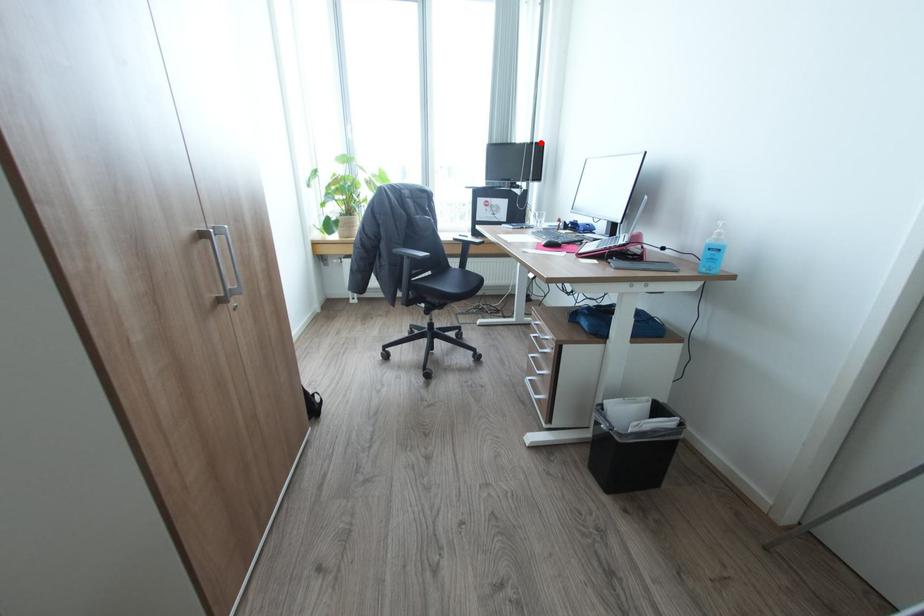
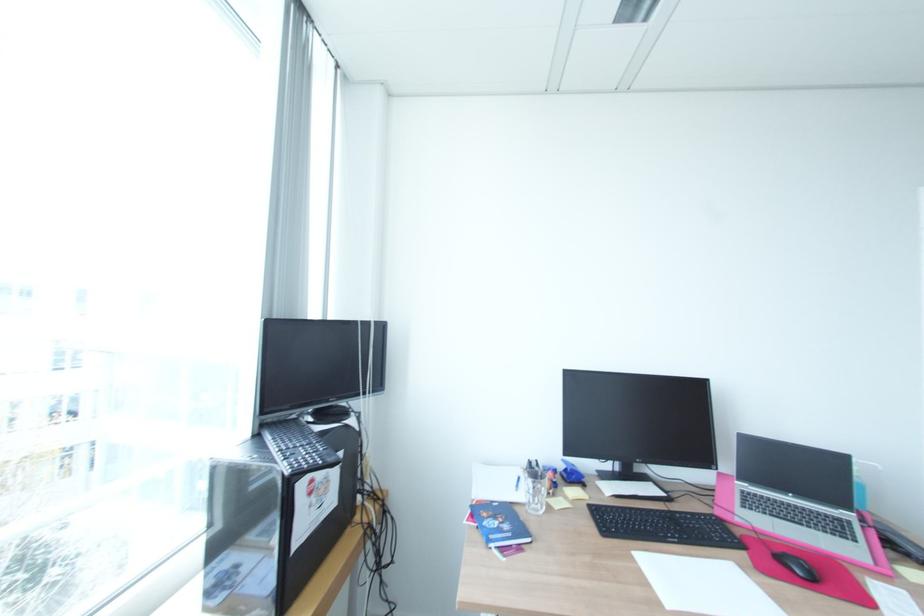
The point at the highlighted location is marked in the first image. Where is the corresponding point in the second image?

(381, 321)